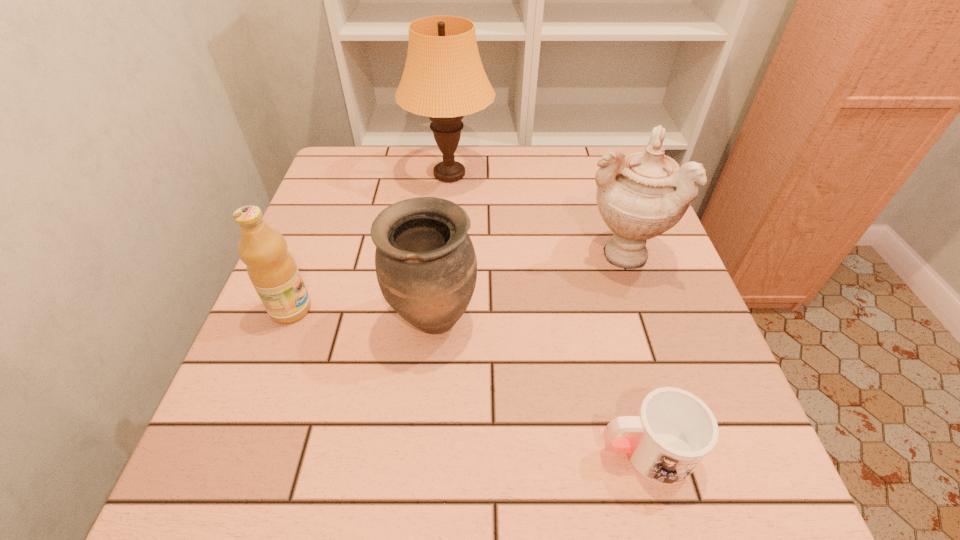
Locate an element on the screen. This screenshot has height=540, width=960. vacant region located 0.150m on the left of the right urn is located at coordinates (509, 253).

Identify the location of free space located 0.060m on the back of the shorter urn. This screenshot has height=540, width=960. (438, 267).

I want to click on vacant space located 0.350m on the label of the leftmost object, so click(488, 309).

This screenshot has width=960, height=540. Find the location of `vacant space located on the side of the shortest object with the handle`. vacant space located on the side of the shortest object with the handle is located at coordinates pos(442,451).

This screenshot has width=960, height=540. Find the location of `vacant region located on the side of the shortest object with the handle`. vacant region located on the side of the shortest object with the handle is located at coordinates (364, 451).

Identify the location of vacant area situated on the side of the shortest object with the handle. This screenshot has height=540, width=960. (357, 451).

You are a GUI agent. You are given a task and a screenshot of the screen. Output one action in this format:
    pyautogui.click(x=<x>, y=<y>)
    Task: Click on the object that is at the far edge
    The width and height of the screenshot is (960, 540).
    Given the screenshot: What is the action you would take?
    pyautogui.click(x=444, y=79)

Find the location of a particular element. This screenshot has height=540, width=960. object located at the near edge is located at coordinates (673, 431).

This screenshot has width=960, height=540. In order to click on object that is at the left edge in this screenshot , I will do `click(272, 270)`.

I want to click on urn at the right edge, so click(641, 195).